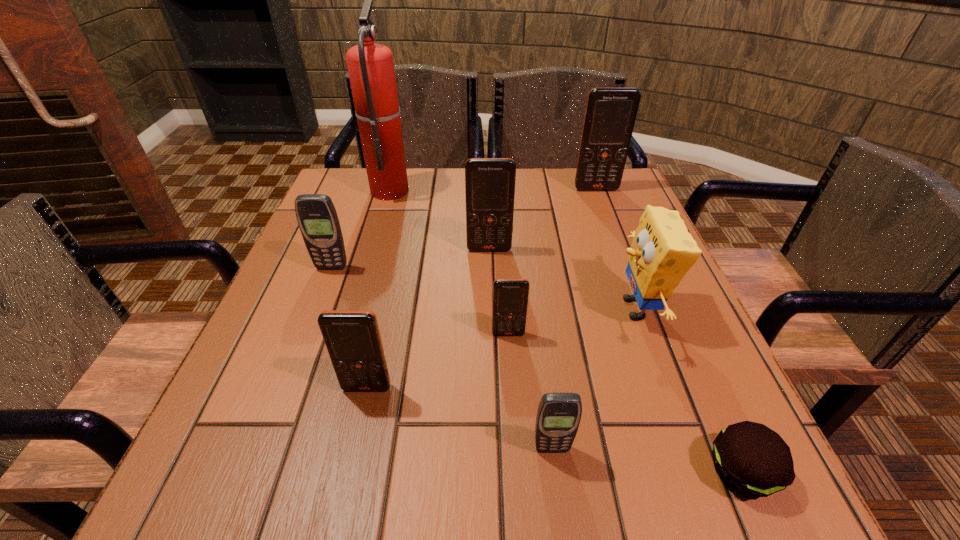
The height and width of the screenshot is (540, 960). Identify the location of fire extinguisher at the left edge. pos(370,65).

At what (x,y) coordinates should I click in order to perform the action: click on cellular telephone that is at the left edge. Please return your answer as a coordinate pair (x, y). Looking at the image, I should click on (317, 218).

I want to click on cellular telephone that is at the right edge, so click(610, 115).

The image size is (960, 540). I want to click on sponge that is positioned at the right edge, so click(x=662, y=252).

This screenshot has height=540, width=960. I want to click on patty that is positioned at the right edge, so click(752, 459).

Image resolution: width=960 pixels, height=540 pixels. I want to click on object positioned at the far left corner, so click(370, 65).

This screenshot has width=960, height=540. What are the coordinates of `object present at the far right corner` in the screenshot? It's located at click(x=610, y=115).

At what (x,y) coordinates should I click in order to perform the action: click on object located in the near right corner section of the desktop. Please return your answer as a coordinate pair (x, y). This screenshot has width=960, height=540. Looking at the image, I should click on (752, 459).

The width and height of the screenshot is (960, 540). What are the coordinates of `vacant space at the far edge of the desktop` in the screenshot? It's located at (546, 212).

I want to click on free space at the left edge, so 357,261.